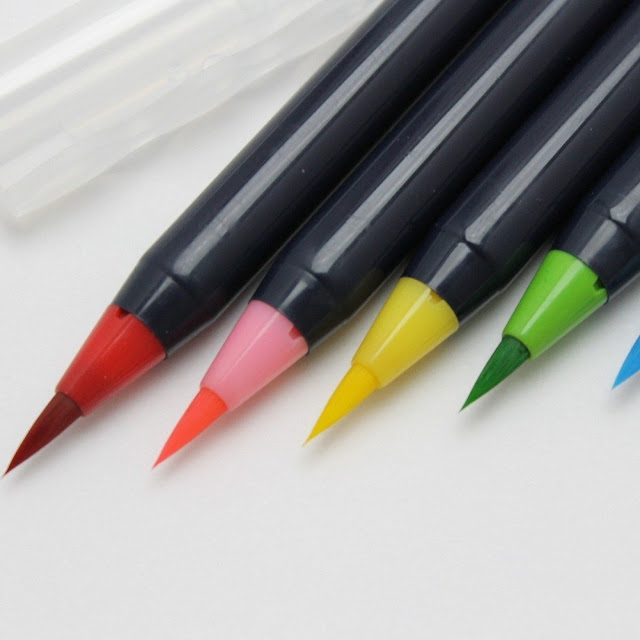
Find the location of a particular element. ink markers is located at coordinates (249, 194), (358, 196), (502, 189), (609, 201).